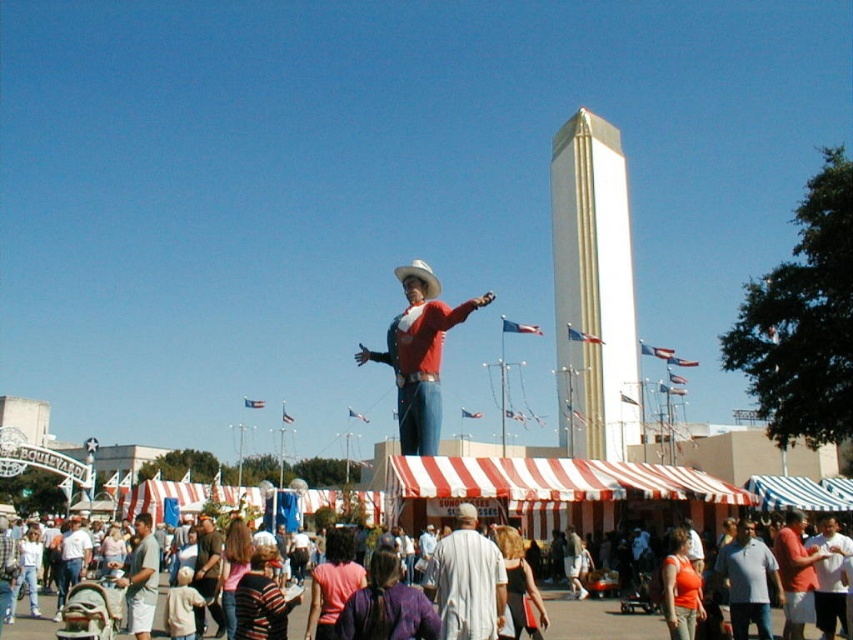
You are at the fair and want to locate two specific items in the scene. You see the denim jeans at lower center and the light brown shirt at lower left. Which item is positioned more to the right side of the image?

The denim jeans at lower center is positioned more to the right side of the image compared to the light brown shirt at lower left.

You are a photographer trying to capture the cowboy statue and its clothing details. You notice the matte red shirt at center and the denim jeans at lower center. Which piece of clothing is positioned to the right side of the other?

The matte red shirt at center is to the right of denim jeans at lower center.

Based on the photo, you are standing at the fair and want to take a photo of both the white smooth obelisk at center and the light gray cotton shirt at center in the same frame. Given that your camera has a maximum focus range of 200 feet, will you be able to capture both objects clearly in one shot?

The white smooth obelisk at center is 219.93 feet away from the light gray cotton shirt at center. Since the distance between them exceeds the camera maximum focus range of 200 feet, you won not be able to capture both objects clearly in one shot.